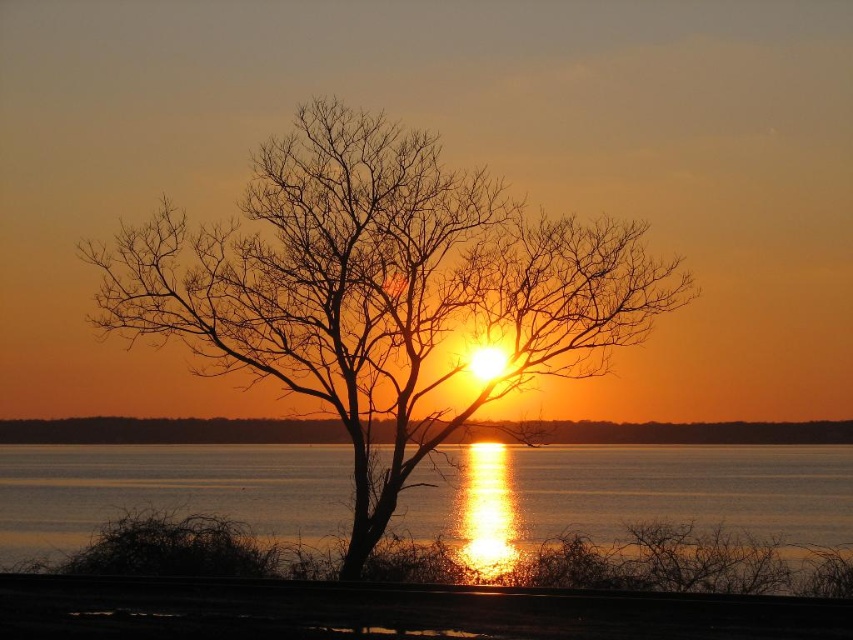
Question: Which point is farther from the camera taking this photo?

Choices:
 (A) (227, 429)
 (B) (463, 204)

Answer: (A)

Question: Which point appears farthest from the camera in this image?

Choices:
 (A) [x=379, y=440]
 (B) [x=389, y=417]
 (C) [x=656, y=460]

Answer: (C)

Question: Which of the following is the farthest from the observer?

Choices:
 (A) (62, 465)
 (B) (305, 122)
 (C) (61, 428)

Answer: (A)

Question: Is brown/dry wood tree at center wider than smooth orange sky at center?

Choices:
 (A) no
 (B) yes

Answer: (A)

Question: Is brown/dry wood tree at center in front of smooth orange sky at center?

Choices:
 (A) yes
 (B) no

Answer: (A)

Question: Can you confirm if smooth water at center is positioned above smooth orange sky at center?

Choices:
 (A) no
 (B) yes

Answer: (A)